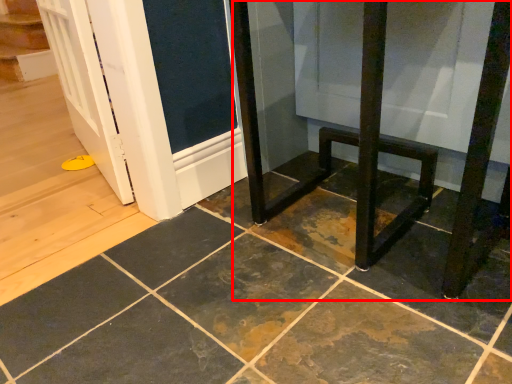
Question: Considering the relative positions of furniture (annotated by the red box) and ceramic tile in the image provided, where is furniture (annotated by the red box) located with respect to the staircase?

Choices:
 (A) left
 (B) right

Answer: (B)